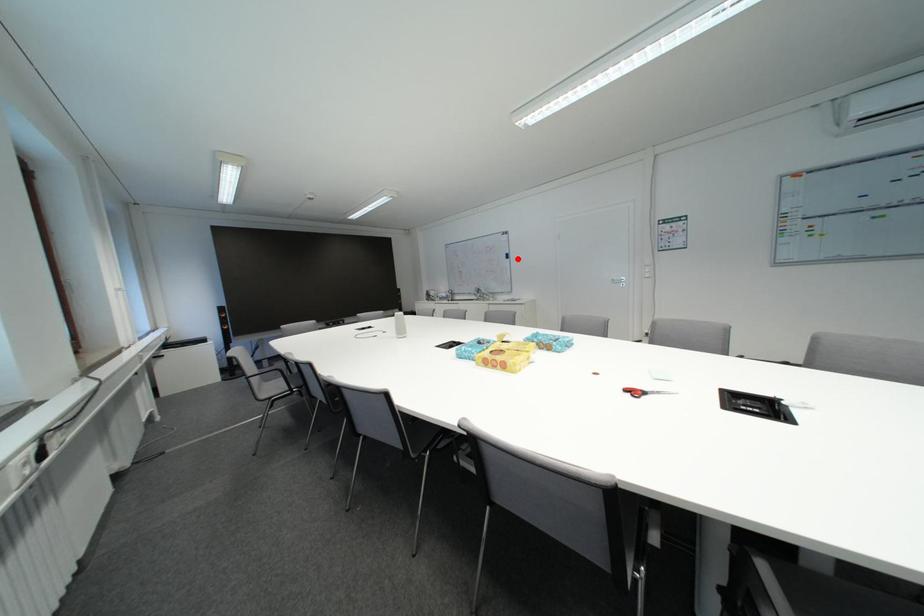
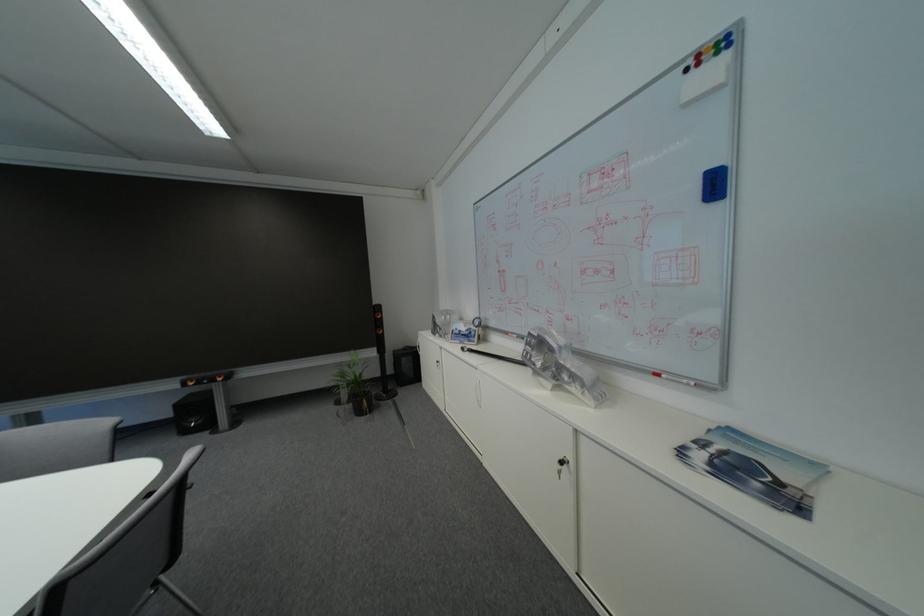
The point at the highlighted location is marked in the first image. Where is the corresponding point in the second image?

(726, 188)